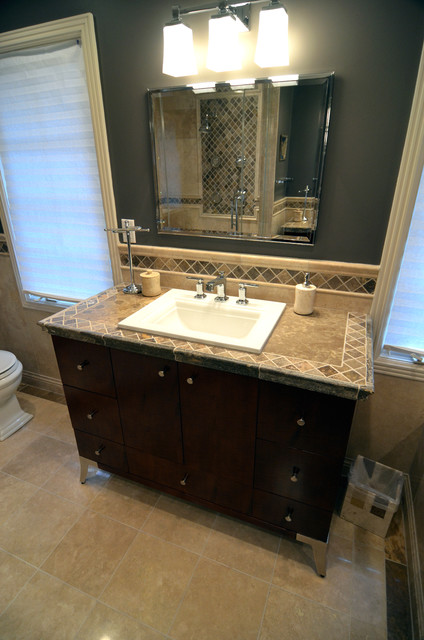
This screenshot has height=640, width=424. I want to click on trash can, so click(377, 498).